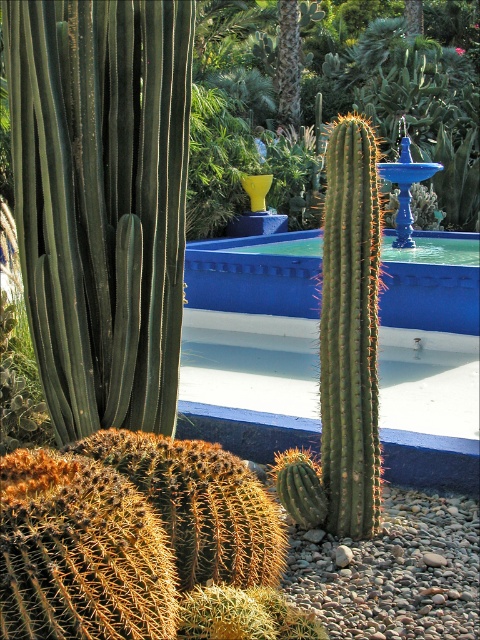
Question: Where is green spiny cactus at center located in relation to blue smooth pool at center in the image?

Choices:
 (A) right
 (B) left

Answer: (A)

Question: Does green spiny cactus at center have a smaller size compared to blue smooth pool at center?

Choices:
 (A) yes
 (B) no

Answer: (B)

Question: Which of the following is the closest to the observer?

Choices:
 (A) blue smooth pool at center
 (B) green spiny cactus at center

Answer: (A)

Question: Which of the following is the farthest from the observer?

Choices:
 (A) (354, 13)
 (B) (406, 316)

Answer: (A)

Question: Does green spiny cactus at center appear on the right side of blue smooth pool at center?

Choices:
 (A) no
 (B) yes

Answer: (B)